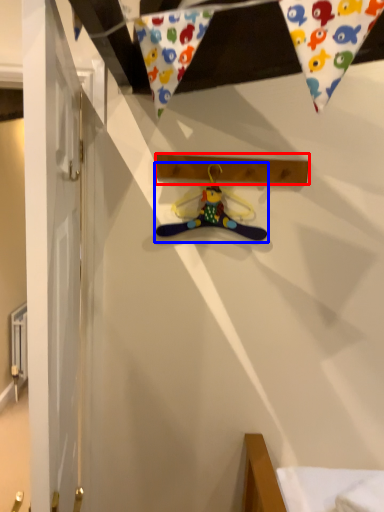
Question: Among these objects, which one is farthest to the camera, plank (highlighted by a red box) or hanger (highlighted by a blue box)?

Choices:
 (A) plank
 (B) hanger

Answer: (B)